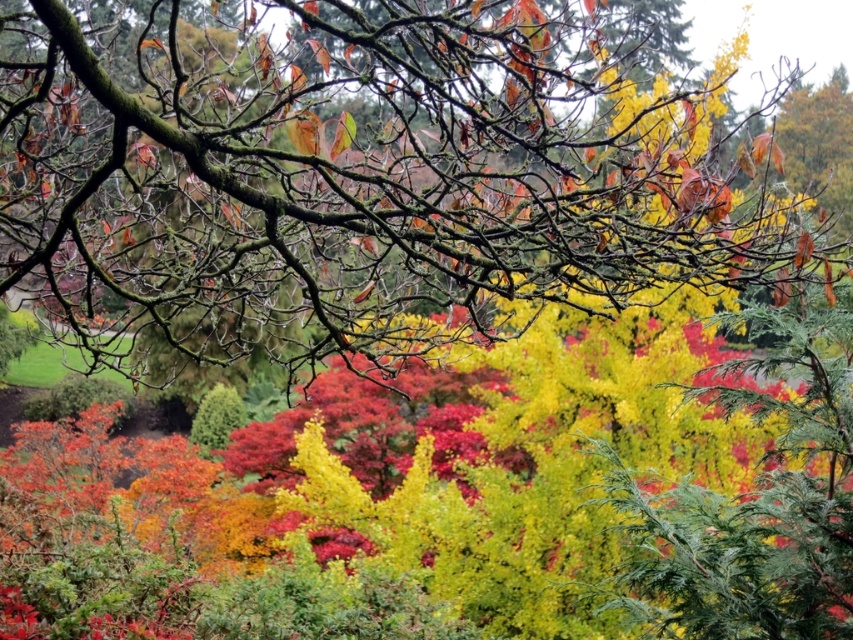
Question: Does smooth bark tree at center appear under green matte bush at center?

Choices:
 (A) yes
 (B) no

Answer: (B)

Question: Is smooth bark tree at center wider than green matte bush at center?

Choices:
 (A) yes
 (B) no

Answer: (B)

Question: Is smooth bark tree at center smaller than green matte bush at center?

Choices:
 (A) yes
 (B) no

Answer: (A)